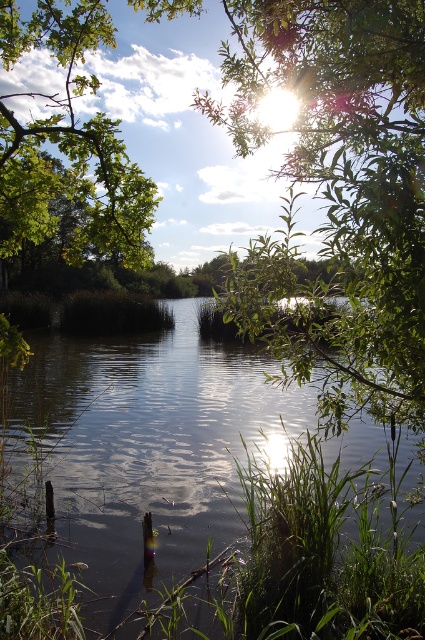
Question: Does smooth dark water at center have a smaller size compared to green leafy tree at upper left?

Choices:
 (A) no
 (B) yes

Answer: (B)

Question: Can you confirm if smooth dark water at center is wider than green leafy tree at upper center?

Choices:
 (A) yes
 (B) no

Answer: (B)

Question: Which point is farther from the camera taking this photo?

Choices:
 (A) (122, 582)
 (B) (14, 218)
 (C) (226, 125)

Answer: (C)

Question: Estimate the real-world distances between objects in this image. Which object is closer to the green leafy tree at upper left?

Choices:
 (A) smooth dark water at center
 (B) green leafy tree at upper center

Answer: (B)

Question: Which point appears closest to the camera in this image?

Choices:
 (A) (91, 42)
 (B) (353, 608)

Answer: (A)

Question: Is smooth dark water at center below green leafy tree at upper center?

Choices:
 (A) no
 (B) yes

Answer: (B)